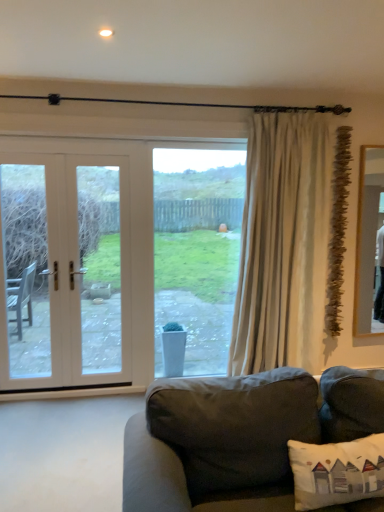
Describe the element at coordinates (283, 244) in the screenshot. This screenshot has height=512, width=384. I see `beige fabric curtain at right` at that location.

What do you see at coordinates (64, 272) in the screenshot?
I see `white wood door at left` at bounding box center [64, 272].

You are a GUI agent. You are given a task and a screenshot of the screen. Output one action in this format:
    pyautogui.click(x=<x>, y=<y>)
    Task: Click on the dark gray fabric couch at lower center
    The width and height of the screenshot is (384, 512).
    Given the screenshot: What is the action you would take?
    pyautogui.click(x=151, y=472)

Identify the location of white fabric pillow at lower right. (337, 471).

Is white fabric pillow at lower right in front of or behind beige fabric curtain at right in the image?

Visually, white fabric pillow at lower right is located in front of beige fabric curtain at right.

Which of these two, white fabric pillow at lower right or beige fabric curtain at right, is bigger?

Bigger between the two is beige fabric curtain at right.

What's the angular difference between white fabric pillow at lower right and beige fabric curtain at right's facing directions?

There is a 2.02-degree angle between the facing directions of white fabric pillow at lower right and beige fabric curtain at right.

Is beige fabric curtain at right located within white fabric pillow at lower right?

No, beige fabric curtain at right is not inside white fabric pillow at lower right.

Consider the image. Can you confirm if dark gray fabric couch at lower center is shorter than white wood door at left?

Indeed, dark gray fabric couch at lower center has a lesser height compared to white wood door at left.

Identify the location of studio couch below the white wood door at left (from a real-world perspective). (151, 472).

Are dark gray fabric couch at lower center and white wood door at left located far from each other?

Indeed, dark gray fabric couch at lower center is not near white wood door at left.

Does dark gray fabric couch at lower center appear on the right side of white wood door at left?

Indeed, dark gray fabric couch at lower center is positioned on the right side of white wood door at left.

Is white fabric pillow at lower right aimed at dark gray fabric couch at lower center?

Yes, white fabric pillow at lower right faces towards dark gray fabric couch at lower center.

Considering the relative sizes of white fabric pillow at lower right and dark gray fabric couch at lower center in the image provided, is white fabric pillow at lower right smaller than dark gray fabric couch at lower center?

Indeed, white fabric pillow at lower right has a smaller size compared to dark gray fabric couch at lower center.

Is white fabric pillow at lower right positioned far away from dark gray fabric couch at lower center?

No, white fabric pillow at lower right is not far from dark gray fabric couch at lower center.

Does white fabric pillow at lower right turn towards white wood door at left?

No, white fabric pillow at lower right does not turn towards white wood door at left.

Based on their sizes in the image, would you say white fabric pillow at lower right is bigger or smaller than white wood door at left?

In the image, white fabric pillow at lower right appears to be smaller than white wood door at left.

Which is further, (330,447) or (40,160)?

The point (40,160) is farther.

Which object is positioned more to the left, white wood door at left or dark gray fabric couch at lower center?

white wood door at left.

In order to click on door located behind the dark gray fabric couch at lower center in this screenshot , I will do `click(64, 272)`.

Can you confirm if white wood door at left is shorter than dark gray fabric couch at lower center?

Incorrect, the height of white wood door at left does not fall short of that of dark gray fabric couch at lower center.

From the image's perspective, is white wood door at left located above or below dark gray fabric couch at lower center?

white wood door at left is above dark gray fabric couch at lower center.

Which of these two, beige fabric curtain at right or clear glass window at center, is thinner?

With smaller width is clear glass window at center.

Considering the relative positions of beige fabric curtain at right and clear glass window at center in the image provided, is beige fabric curtain at right in front of clear glass window at center?

That is True.

From a real-world perspective, is dark gray fabric couch at lower center on top of beige fabric curtain at right?

No, from a real-world perspective, dark gray fabric couch at lower center is not above beige fabric curtain at right.

From the image's perspective, between dark gray fabric couch at lower center and beige fabric curtain at right, who is located below?

dark gray fabric couch at lower center appears lower in the image.

Could you tell me if dark gray fabric couch at lower center is facing beige fabric curtain at right?

No.

Which object is closer to the camera, dark gray fabric couch at lower center or beige fabric curtain at right?

Positioned in front is dark gray fabric couch at lower center.

Find the location of a particular element. The width and height of the screenshot is (384, 512). pillow below the beige fabric curtain at right (from the image's perspective) is located at coordinates (337, 471).

You are a GUI agent. You are given a task and a screenshot of the screen. Output one action in this format:
    pyautogui.click(x=<x>, y=<y>)
    Task: Click on the studio couch that is under the white wood door at left (from a real-world perspective)
    The height and width of the screenshot is (512, 384).
    Given the screenshot: What is the action you would take?
    pyautogui.click(x=151, y=472)

Looking at this image, considering their positions, is clear glass window at center positioned further to white wood door at left than white fabric pillow at lower right?

The object further to white wood door at left is white fabric pillow at lower right.

Based on their spatial positions, is white wood door at left or dark gray fabric couch at lower center further from clear glass window at center?

Answer: dark gray fabric couch at lower center lies further to clear glass window at center than the other object.

Looking at the image, which one is located further to dark gray fabric couch at lower center, white wood door at left or beige fabric curtain at right?

white wood door at left lies further to dark gray fabric couch at lower center than the other object.

Based on their spatial positions, is white fabric pillow at lower right or clear glass window at center closer to white wood door at left?

clear glass window at center.

Based on their spatial positions, is white wood door at left or beige fabric curtain at right further from clear glass window at center?

Among the two, white wood door at left is located further to clear glass window at center.

Based on their spatial positions, is dark gray fabric couch at lower center or white fabric pillow at lower right closer to clear glass window at center?

Among the two, dark gray fabric couch at lower center is located nearer to clear glass window at center.

Looking at the image, which one is located further to clear glass window at center, beige fabric curtain at right or dark gray fabric couch at lower center?

The object further to clear glass window at center is dark gray fabric couch at lower center.

Which object lies further to the anchor point dark gray fabric couch at lower center, white fabric pillow at lower right or white wood door at left?

white wood door at left lies further to dark gray fabric couch at lower center than the other object.

Identify the location of pillow between dark gray fabric couch at lower center and beige fabric curtain at right in the front-back direction. (337, 471).

You are a GUI agent. You are given a task and a screenshot of the screen. Output one action in this format:
    pyautogui.click(x=<x>, y=<y>)
    Task: Click on the curtain located between dark gray fabric couch at lower center and clear glass window at center in the depth direction
    
    Given the screenshot: What is the action you would take?
    pyautogui.click(x=283, y=244)

At what (x,y) coordinates should I click in order to perform the action: click on curtain positioned between dark gray fabric couch at lower center and white wood door at left from near to far. Please return your answer as a coordinate pair (x, y). Looking at the image, I should click on (283, 244).

Locate an element on the screen. This screenshot has width=384, height=512. curtain located between white fabric pillow at lower right and clear glass window at center in the depth direction is located at coordinates (283, 244).